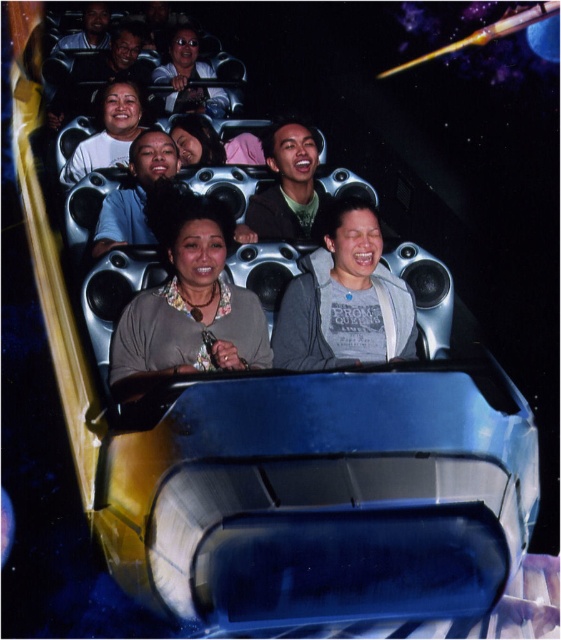
Question: Which point is closer to the camera?

Choices:
 (A) matte black jacket at upper center
 (B) matte gray sweater at center

Answer: (B)

Question: Is matte gray sweater at center positioned before matte black jacket at upper center?

Choices:
 (A) no
 (B) yes

Answer: (B)

Question: Is matte gray sweater at center positioned in front of matte black jacket at upper center?

Choices:
 (A) yes
 (B) no

Answer: (A)

Question: Which of the following is the farthest from the observer?

Choices:
 (A) matte gray sweater at center
 (B) matte black jacket at upper center

Answer: (B)

Question: Which of the following is the farthest from the observer?

Choices:
 (A) (167, 65)
 (B) (165, 352)

Answer: (A)

Question: Does matte gray sweater at center appear under matte black jacket at upper center?

Choices:
 (A) no
 (B) yes

Answer: (B)